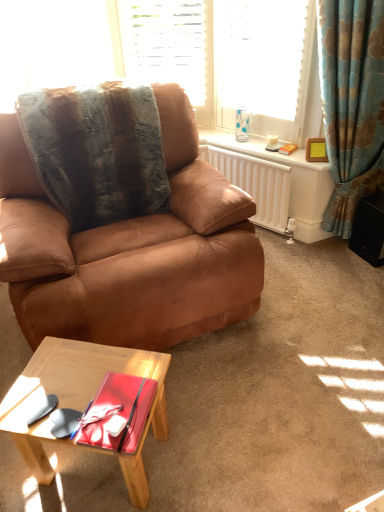
The image size is (384, 512). In order to click on free space on the front side of white matte radiator at upper right in this screenshot , I will do `click(291, 263)`.